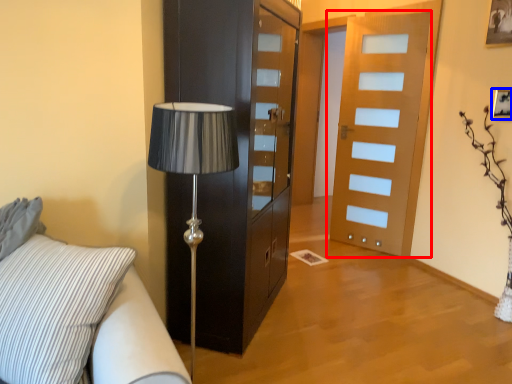
Question: Which of the following is the closest to the observer, door (highlighted by a red box) or picture frame (highlighted by a blue box)?

Choices:
 (A) door
 (B) picture frame

Answer: (B)